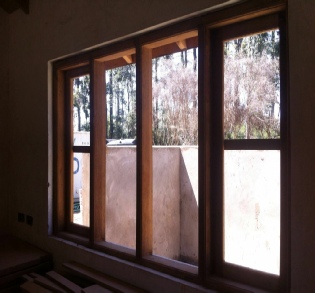
Where is `window frame`? The image size is (315, 293). window frame is located at coordinates (219, 160), (201, 159), (147, 158), (98, 160), (63, 162).